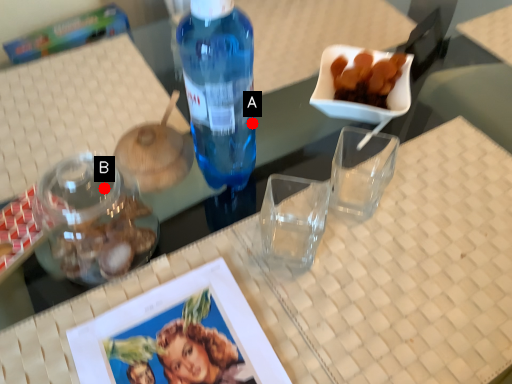
Question: Two points are circled on the image, labeled by A and B beside each circle. Which point is farther to the camera?

Choices:
 (A) A is further
 (B) B is further

Answer: (B)